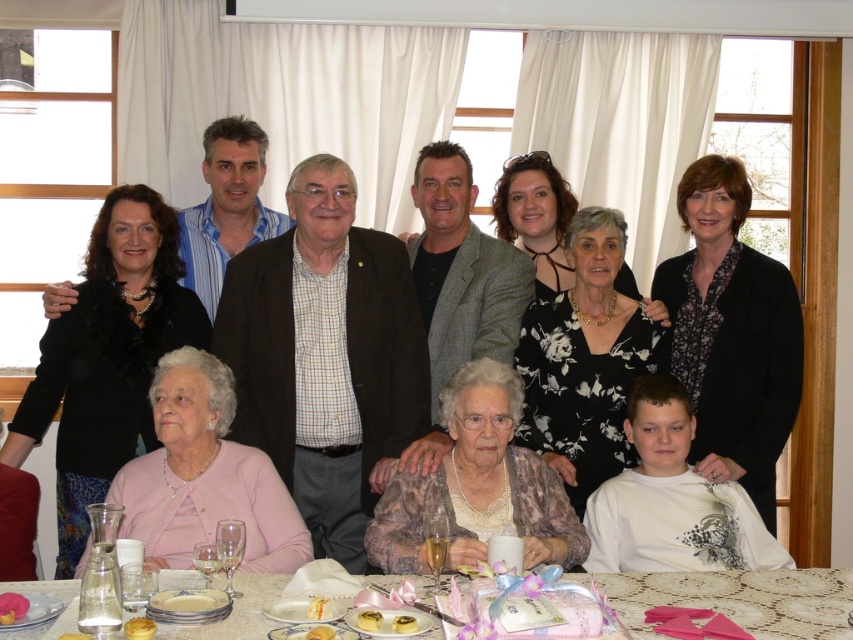
Can you confirm if white porcelain plate at lower center is positioned to the right of yellow custard at center?

No, white porcelain plate at lower center is not to the right of yellow custard at center.

At what (x,y) coordinates should I click in order to perform the action: click on white porcelain plate at lower center. Please return your answer as a coordinate pair (x, y). The height and width of the screenshot is (640, 853). Looking at the image, I should click on (189, 602).

Does smooth white cake at center have a larger size compared to yellow custard at center?

Yes, smooth white cake at center is bigger than yellow custard at center.

Measure the distance between point (329, 602) and camera.

Point (329, 602) and camera are 6.75 feet apart.

What do you see at coordinates (318, 608) in the screenshot?
I see `smooth white cake at center` at bounding box center [318, 608].

Where is `smooth white cake at center`? smooth white cake at center is located at coordinates (x=318, y=608).

Does porcelain plates at center appear over golden cake at lower center?

Incorrect, porcelain plates at center is not positioned above golden cake at lower center.

Between porcelain plates at center and golden cake at lower center, which one appears on the left side from the viewer's perspective?

Positioned to the left is golden cake at lower center.

Does point (54, 634) come farther from viewer compared to point (131, 620)?

No.

This screenshot has height=640, width=853. Find the location of `porcelain plates at center`. porcelain plates at center is located at coordinates (741, 598).